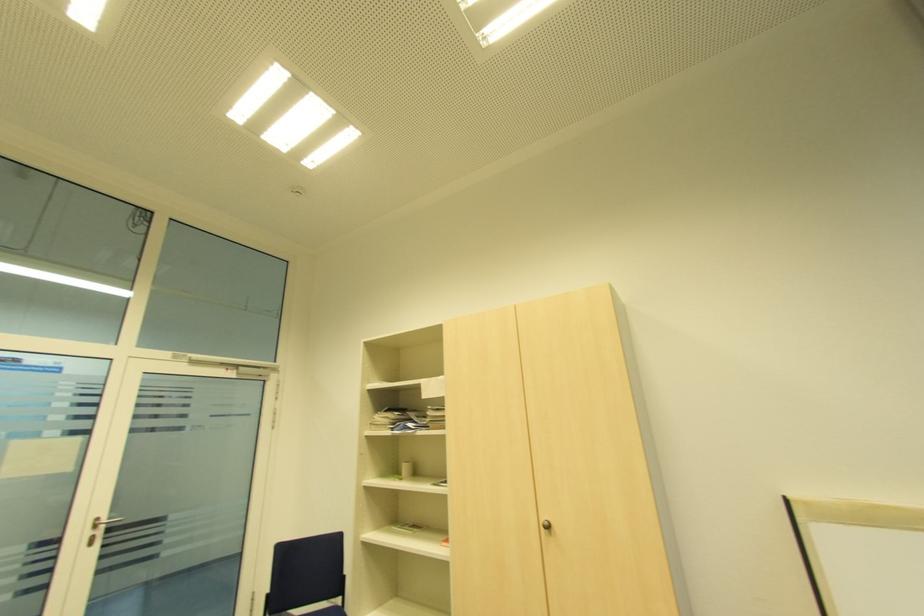
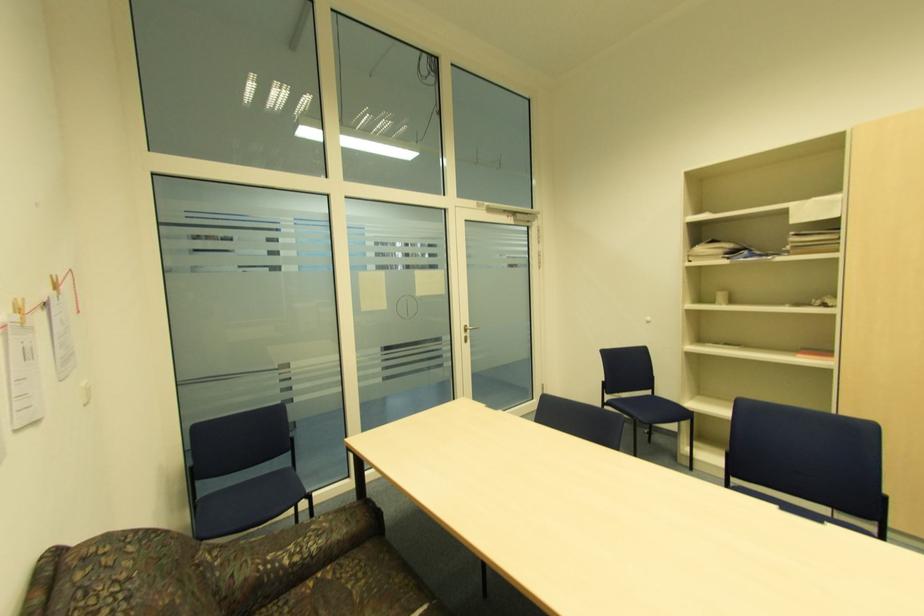
Question: In a continuous first-person perspective shot, in which direction is the camera moving?

Choices:
 (A) Left
 (B) Right
 (C) Forward
 (D) Backward

Answer: (A)